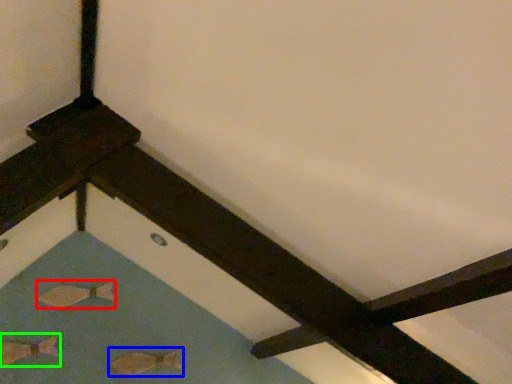
Question: Which object is positioned closest to fish (highlighted by a red box)? Select from fish (highlighted by a blue box) and fish (highlighted by a green box).

Choices:
 (A) fish
 (B) fish

Answer: (B)